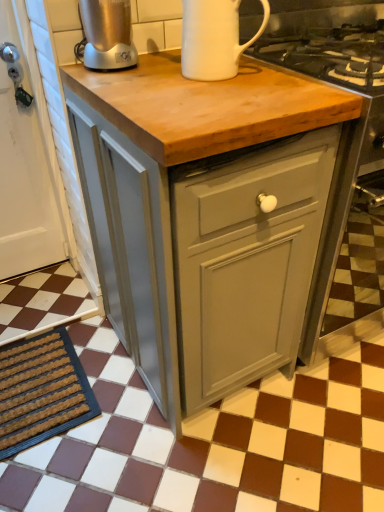
Image resolution: width=384 pixels, height=512 pixels. In order to click on vacant area on top of matte gray cabinet at center (from a real-world perspective) in this screenshot , I will do `click(208, 86)`.